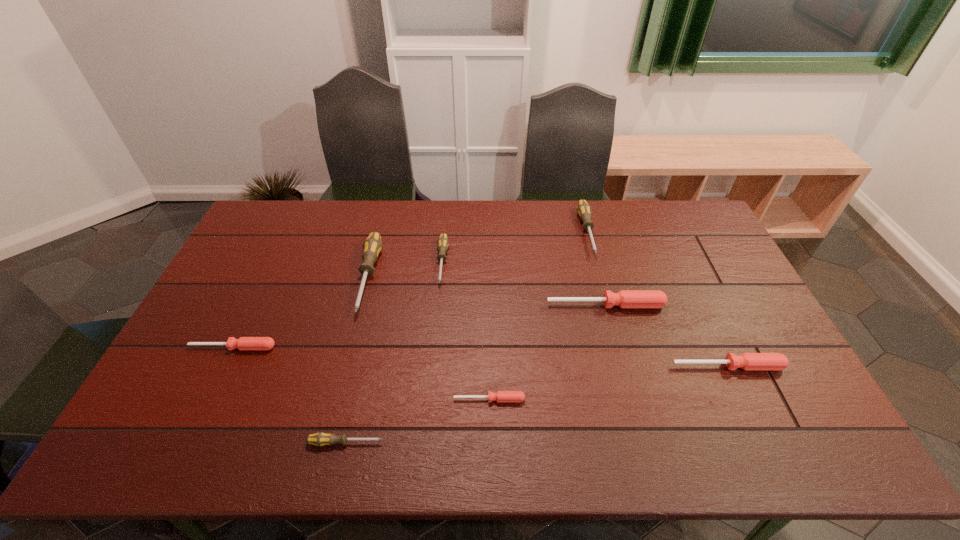
In order to click on free space between the shortest object and the second smallest gray screwdriver in this screenshot , I will do `click(466, 331)`.

Where is `object that can be found as the fifth closest to the leftmost red screwdriver`? The height and width of the screenshot is (540, 960). object that can be found as the fifth closest to the leftmost red screwdriver is located at coordinates (626, 299).

I want to click on object that ranks as the second closest to the nearest object, so click(x=243, y=343).

Identify which screwdriver is the closest to the nearest screwdriver. Please provide its 2D coordinates. Your answer should be formatted as a tuple, i.e. [(x, y)], where the tuple contains the x and y coordinates of a point satisfying the conditions above.

[(500, 396)]

Locate which screwdriver ranks second in proximity to the smallest gray screwdriver. Please provide its 2D coordinates. Your answer should be formatted as a tuple, i.e. [(x, y)], where the tuple contains the x and y coordinates of a point satisfying the conditions above.

[(243, 343)]

This screenshot has width=960, height=540. Find the location of `gray screwdriver object that ranks as the second closest to the third smallest red screwdriver`. gray screwdriver object that ranks as the second closest to the third smallest red screwdriver is located at coordinates (442, 242).

Locate an element on the screen. This screenshot has height=540, width=960. gray screwdriver that stands as the closest to the second biggest red screwdriver is located at coordinates (583, 208).

You are a GUI agent. You are given a task and a screenshot of the screen. Output one action in this format:
    pyautogui.click(x=<x>, y=<y>)
    Task: Click on the red screwdriver object that ranks as the closest to the second biggest gray screwdriver
    The height and width of the screenshot is (540, 960).
    Given the screenshot: What is the action you would take?
    pyautogui.click(x=626, y=299)

Locate which red screwdriver is the closest to the biggest red screwdriver. Please provide its 2D coordinates. Your answer should be formatted as a tuple, i.e. [(x, y)], where the tuple contains the x and y coordinates of a point satisfying the conditions above.

[(747, 361)]

You are a GUI agent. You are given a task and a screenshot of the screen. Output one action in this format:
    pyautogui.click(x=<x>, y=<y>)
    Task: Click on the free space that satisfies the following two spatial constraints: 1. at the tip of the seventh farthest object; 2. on the left side of the third gray screwdriver from left to right
    The width and height of the screenshot is (960, 540).
    Given the screenshot: What is the action you would take?
    pyautogui.click(x=430, y=399)